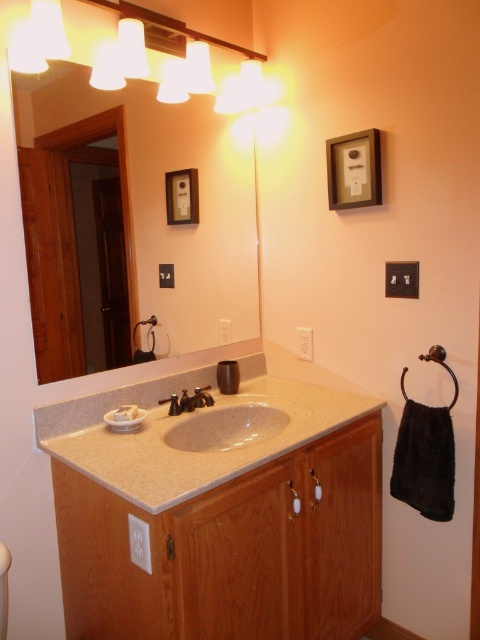
This screenshot has width=480, height=640. Describe the element at coordinates (129, 205) in the screenshot. I see `white glossy mirror at upper center` at that location.

Who is more distant from viewer, (63,234) or (376,164)?

Point (376,164)

Which is in front, point (60, 129) or point (375, 166)?

Point (60, 129) is in front.

Image resolution: width=480 pixels, height=640 pixels. I want to click on white glossy mirror at upper center, so click(x=129, y=205).

Between point (344, 140) and point (182, 394), which one is positioned behind?

The point (182, 394) is behind.

Does point (358, 156) come in front of point (192, 396)?

Yes, it is in front of point (192, 396).

Find the location of a particular element. wooden picture frame at upper center is located at coordinates (354, 170).

Based on the photo, between beige marble sink at center and satin nickel faucet at sink center, which one is positioned lower?

beige marble sink at center is lower down.

Which is in front, point (196, 428) or point (187, 394)?

Point (196, 428) is more forward.

Locate an element on the screen. Image resolution: width=480 pixels, height=640 pixels. beige marble sink at center is located at coordinates (226, 428).